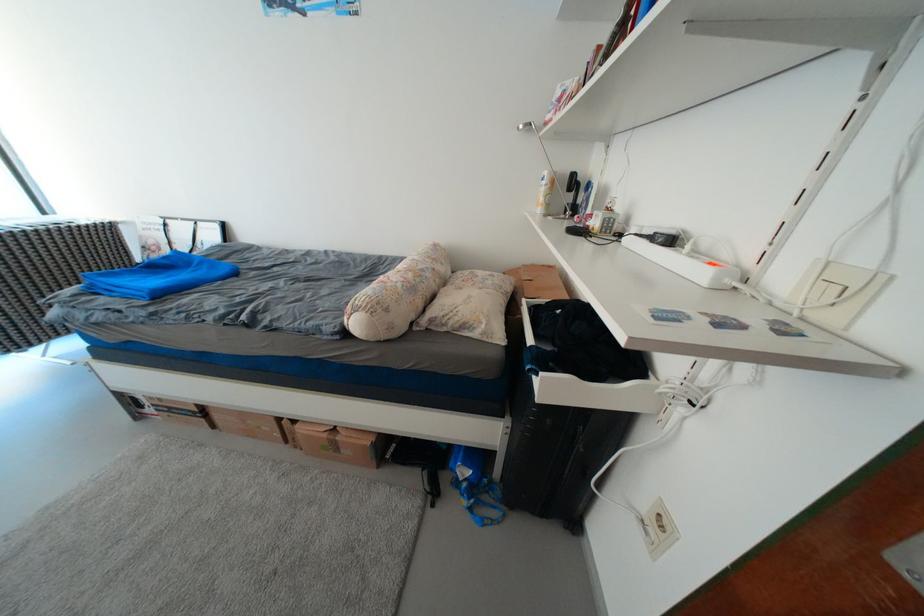
Find where to insert the wall power outlet. Please return your answer as a coordinate pair (x, y).

(657, 517)